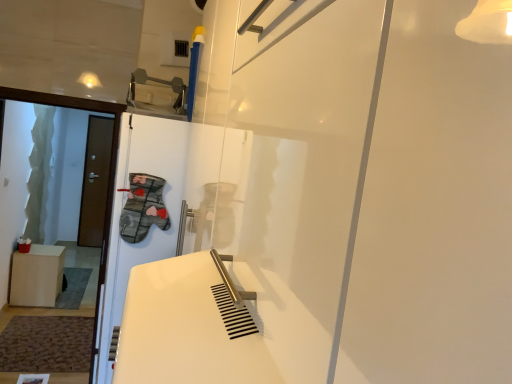
Question: Is brown matte door at left directly adjacent to white matte screen door at center?

Choices:
 (A) yes
 (B) no

Answer: (B)

Question: Would you say white matte screen door at center is part of brown matte door at left's contents?

Choices:
 (A) no
 (B) yes

Answer: (A)

Question: Does brown matte door at left lie in front of white matte screen door at center?

Choices:
 (A) yes
 (B) no

Answer: (B)

Question: Considering the relative sizes of brown matte door at left and white matte screen door at center in the image provided, is brown matte door at left taller than white matte screen door at center?

Choices:
 (A) yes
 (B) no

Answer: (A)

Question: Is brown matte door at left facing away from white matte screen door at center?

Choices:
 (A) no
 (B) yes

Answer: (A)

Question: Does brown matte door at left lie behind white matte screen door at center?

Choices:
 (A) no
 (B) yes

Answer: (B)

Question: From the image's perspective, is white matte screen door at center located above light brown wooden cabinet at left?

Choices:
 (A) yes
 (B) no

Answer: (A)

Question: Does white matte screen door at center have a smaller size compared to light brown wooden cabinet at left?

Choices:
 (A) yes
 (B) no

Answer: (B)

Question: Is white matte screen door at center positioned beyond the bounds of light brown wooden cabinet at left?

Choices:
 (A) no
 (B) yes

Answer: (B)

Question: Is white matte screen door at center shorter than light brown wooden cabinet at left?

Choices:
 (A) yes
 (B) no

Answer: (B)

Question: Is the surface of white matte screen door at center in direct contact with light brown wooden cabinet at left?

Choices:
 (A) yes
 (B) no

Answer: (B)

Question: Is white matte screen door at center to the right of light brown wooden cabinet at left from the viewer's perspective?

Choices:
 (A) yes
 (B) no

Answer: (A)

Question: Can you confirm if light brown wooden cabinet at left is positioned to the left of white matte screen door at center?

Choices:
 (A) yes
 (B) no

Answer: (A)